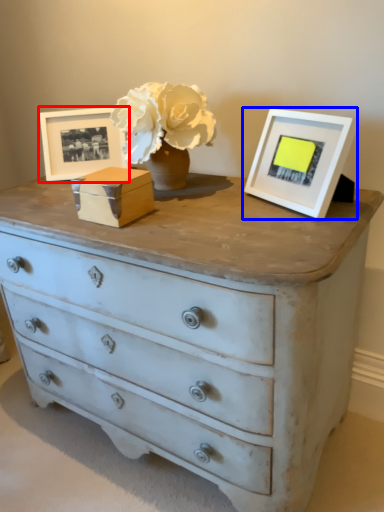
Question: Which object appears farthest to the camera in this image, picture frame (highlighted by a red box) or picture frame (highlighted by a blue box)?

Choices:
 (A) picture frame
 (B) picture frame

Answer: (A)